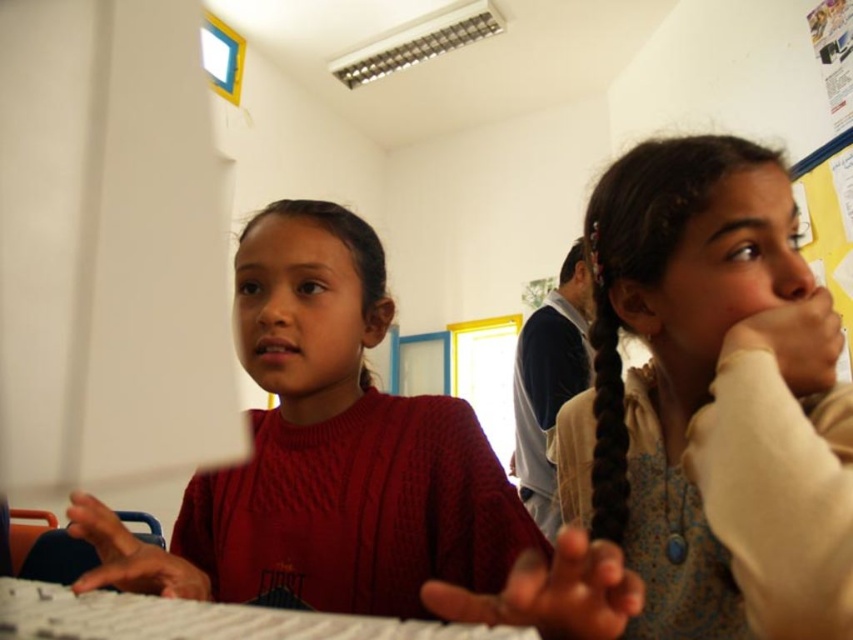
Question: Which object is the farthest from the light brown textured sweater at right?

Choices:
 (A) cable-knit sweater at center
 (B) black silky hair at right
 (C) white plastic keyboard at center

Answer: (C)

Question: Is white plastic keyboard at center positioned in front of black silky hair at right?

Choices:
 (A) no
 (B) yes

Answer: (B)

Question: Estimate the real-world distances between objects in this image. Which object is closer to the white plastic keyboard at center?

Choices:
 (A) light brown textured sweater at right
 (B) black silky hair at right
 (C) cable-knit sweater at center

Answer: (C)

Question: Is cable-knit sweater at center thinner than white plastic keyboard at center?

Choices:
 (A) yes
 (B) no

Answer: (A)

Question: Which object is farther from the camera taking this photo?

Choices:
 (A) light brown textured sweater at right
 (B) cable-knit sweater at center

Answer: (B)

Question: Can you confirm if light brown textured sweater at right is thinner than white plastic keyboard at center?

Choices:
 (A) no
 (B) yes

Answer: (B)